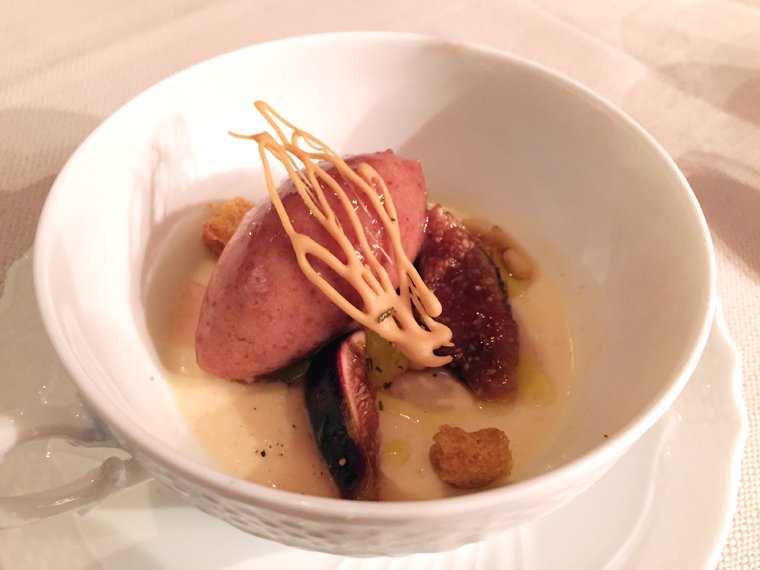
The width and height of the screenshot is (760, 570). What are the coordinates of `plate` in the screenshot? It's located at (73, 472).